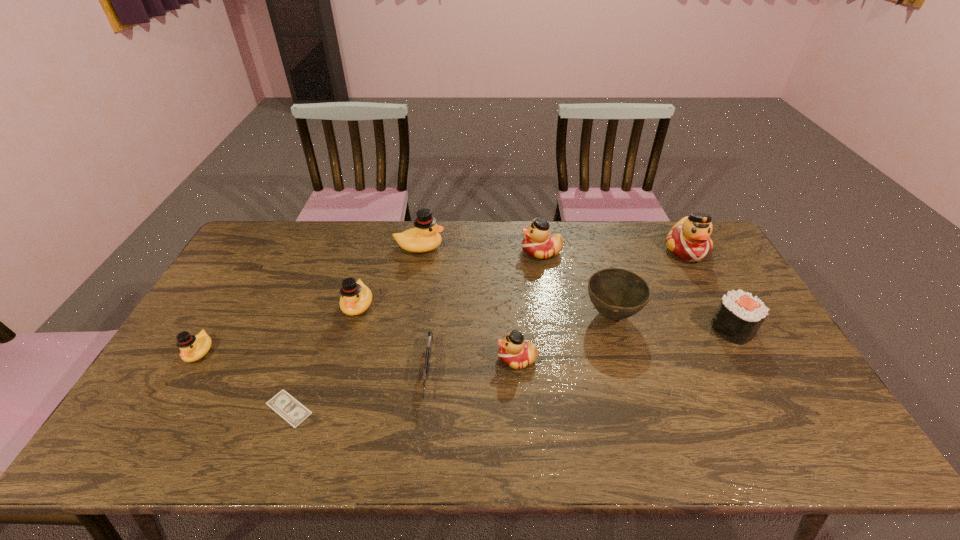
You are a GUI agent. You are given a task and a screenshot of the screen. Output one action in this format:
    pyautogui.click(x=<x>, y=<y>)
    Task: Click on the object that is at the near edge
    The height and width of the screenshot is (540, 960).
    Given the screenshot: What is the action you would take?
    pyautogui.click(x=291, y=410)

The image size is (960, 540). What are the coordinates of `object situated at the left edge` in the screenshot? It's located at (193, 348).

Identify the location of duck that is at the right edge. (689, 239).

In order to click on sushi at the right edge in this screenshot , I will do `click(739, 316)`.

You are a GUI agent. You are given a task and a screenshot of the screen. Output one action in this format:
    pyautogui.click(x=<x>, y=<y>)
    Task: Click on the object at the far right corner
    
    Given the screenshot: What is the action you would take?
    pyautogui.click(x=689, y=239)

The image size is (960, 540). In order to click on blank space at the far edge of the desktop in this screenshot , I will do `click(652, 236)`.

The image size is (960, 540). Identify the location of vacant region at the near edge. (722, 437).

The width and height of the screenshot is (960, 540). I want to click on vacant space at the left edge of the desktop, so click(x=235, y=289).

Find the location of a particular element. free space at the far right corner is located at coordinates (709, 256).

The height and width of the screenshot is (540, 960). In order to click on free space that is in between the sushi and the brown bowl in this screenshot , I will do `click(672, 322)`.